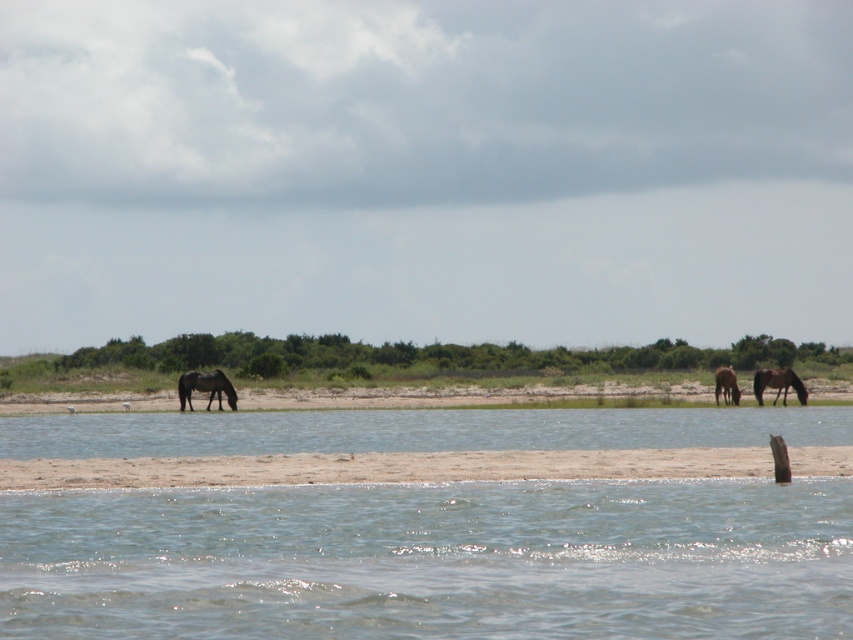
You are a photographer trying to capture both the brown matte horse at right and the brown glossy horse at right in a single shot. Based on their sizes, which horse would appear larger in the photo?

The brown matte horse at right would appear larger in the photo since it is much taller than the brown glossy horse at right.

You are standing at the bottom of the image and want to locate the dark brown glossy horse at center. Which direction should you look to find it?

You should look towards the center of the image to find the dark brown glossy horse at center, as it is located at point (206, 387).

Please use the coordinates provided to determine the position of the dark brown glossy horse at center. What is its exact 2D coordinate location in the image?

The dark brown glossy horse at center is located at the 2D coordinate point of (206, 387).